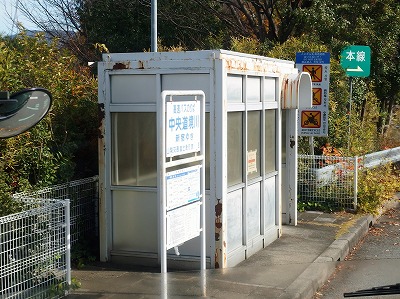
This screenshot has width=400, height=299. Identify the location of mirror. (24, 112).